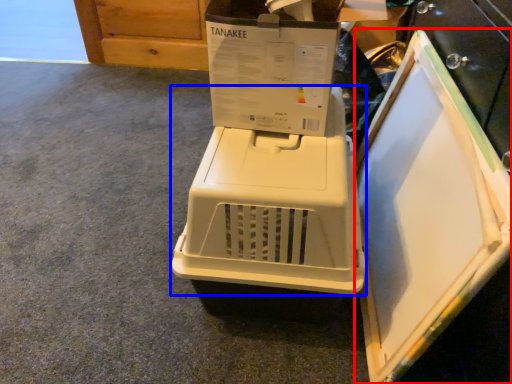
Question: Which object is further to the camera taking this photo, appliance (highlighted by a red box) or home appliance (highlighted by a blue box)?

Choices:
 (A) appliance
 (B) home appliance

Answer: (B)